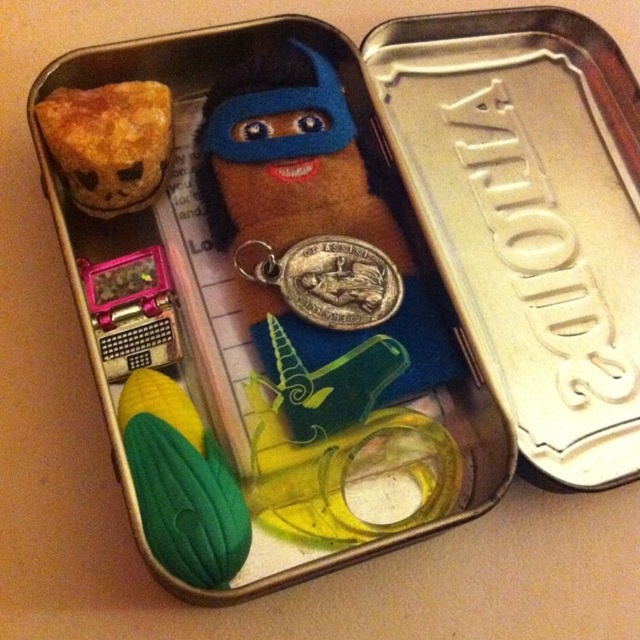
Does green rubber corn at lower left have a smaller size compared to baked golden-brown cake at upper left?

No, green rubber corn at lower left is not smaller than baked golden-brown cake at upper left.

Can you confirm if green rubber corn at lower left is wider than baked golden-brown cake at upper left?

Indeed, green rubber corn at lower left has a greater width compared to baked golden-brown cake at upper left.

Is point (157, 413) in front of point (52, 109)?

Yes, point (157, 413) is closer to viewer.

The height and width of the screenshot is (640, 640). What are the coordinates of `green rubber corn at lower left` in the screenshot? It's located at (180, 483).